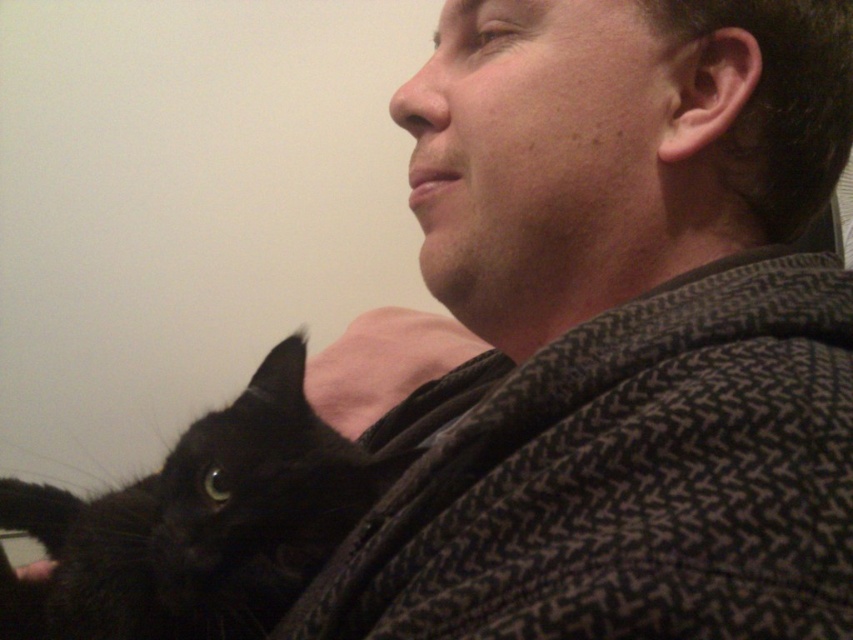
You are trying to decide whether to place a new decorative item on the textured wool sweater at center or the black fur cat at lower left. Based on their sizes, which surface would be more suitable for placing a small object?

The textured wool sweater at center has a lesser width compared to the black fur cat at lower left, so the black fur cat at lower left would provide a more stable and suitable surface for placing a small object due to its larger width.

From the picture: You are a tailor who needs to determine if the textured wool sweater at center can fit into a storage box designed for small items. The box can only accommodate items smaller than the black fur cat at lower left. Can the sweater fit?

The textured wool sweater at center is bigger than the black fur cat at lower left, so it cannot fit into the storage box designed for small items.

You are a tailor measuring the distance between the viewer and the textured wool sweater at center to ensure proper alterations. What is the exact distance you should record?

The exact distance between the viewer and the textured wool sweater at center is 10.23 inches.